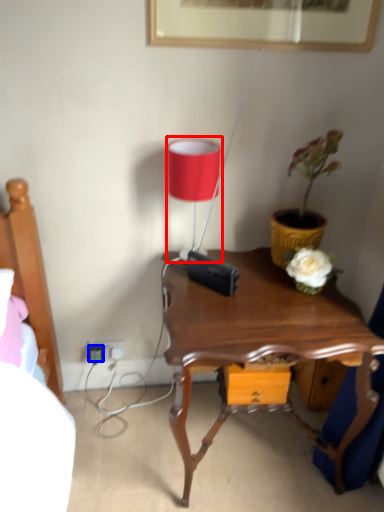
Question: Which object is closer to the camera taking this photo, table lamp (highlighted by a red box) or plug (highlighted by a blue box)?

Choices:
 (A) table lamp
 (B) plug

Answer: (A)